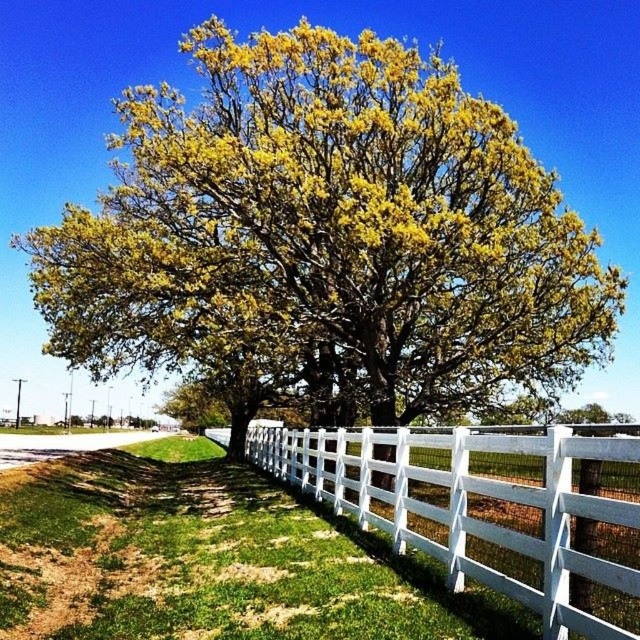
Does yellow-green foliage at center have a smaller size compared to white wooden fence at lower right?

Actually, yellow-green foliage at center might be larger than white wooden fence at lower right.

Does yellow-green foliage at center have a lesser width compared to white wooden fence at lower right?

No.

Who is more forward, (x=81, y=205) or (x=289, y=435)?

Point (x=289, y=435) is in front.

At what (x,y) coordinates should I click in order to perform the action: click on yellow-green foliage at center. Please return your answer as a coordinate pair (x, y). The image size is (640, 640). Looking at the image, I should click on (326, 241).